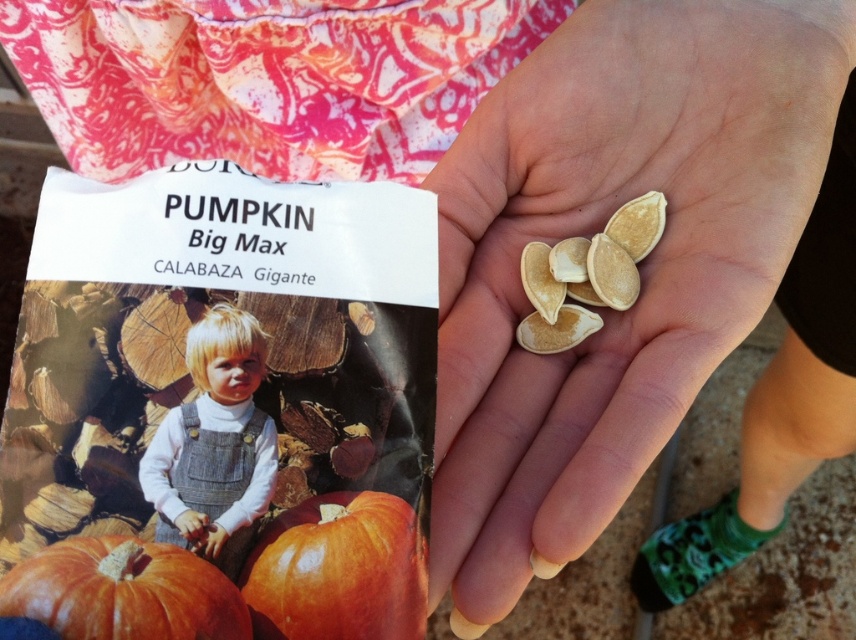
Question: From the image, what is the correct spatial relationship of orange matte pumpkin at center in relation to light brown denim overalls at center?

Choices:
 (A) right
 (B) left

Answer: (A)

Question: Does smooth beige seeds at center come behind white matte pumpkin seeds at center?

Choices:
 (A) no
 (B) yes

Answer: (A)

Question: Which point appears farthest from the camera in this image?

Choices:
 (A) (175, 445)
 (B) (538, 288)
 (C) (394, 624)
 (D) (470, 497)

Answer: (B)

Question: Which object is farther from the camera taking this photo?

Choices:
 (A) white matte pumpkin seeds at center
 (B) smooth beige seeds at center
 (C) orange matte pumpkin at center

Answer: (A)

Question: In this image, where is smooth beige seeds at center located relative to orange matte pumpkin at lower left?

Choices:
 (A) right
 (B) left

Answer: (A)

Question: Among these objects, which one is farthest from the camera?

Choices:
 (A) smooth beige seeds at center
 (B) white matte pumpkin seeds at center
 (C) orange matte pumpkin at lower left
 (D) light brown denim overalls at center

Answer: (B)